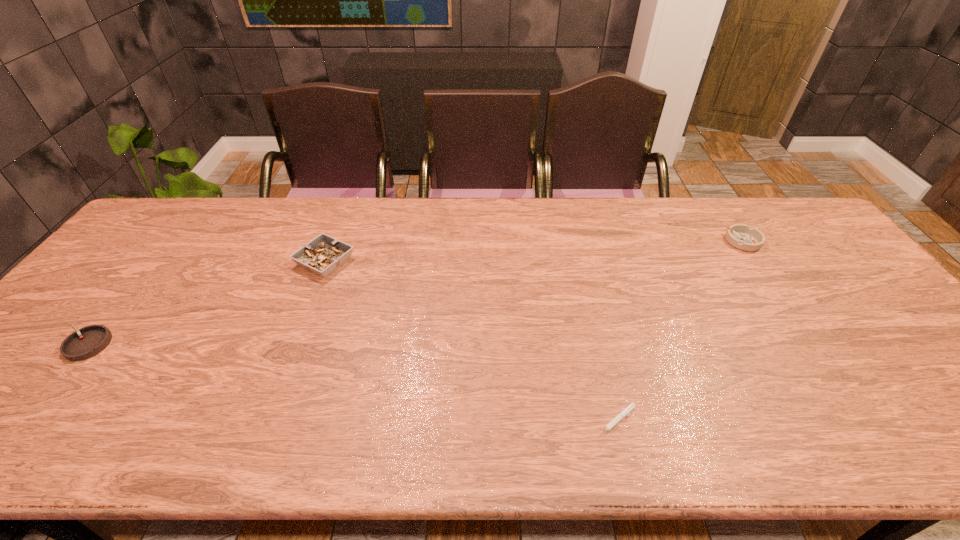
What are the coordinates of `free space between the third object from left to right and the rightmost object` in the screenshot? It's located at (680, 332).

You are a GUI agent. You are given a task and a screenshot of the screen. Output one action in this format:
    pyautogui.click(x=<x>, y=<y>)
    Task: Click on the empty location between the second object from right to left and the rightmost ashtray
    
    Given the screenshot: What is the action you would take?
    pyautogui.click(x=680, y=332)

Locate an element on the screen. Image resolution: width=960 pixels, height=540 pixels. free spot between the rightmost ashtray and the tallest ashtray is located at coordinates (534, 252).

At what (x,y) coordinates should I click in order to perform the action: click on blank region between the syringe and the rightmost object. Please return your answer as a coordinate pair (x, y). The image size is (960, 540). Looking at the image, I should click on (680, 332).

I want to click on empty space between the third object from left to right and the nearest ashtray, so click(x=351, y=383).

Identify the location of unoccupied area between the third object from left to right and the rightmost ashtray. (680, 332).

I want to click on empty space that is in between the third farthest object and the rightmost object, so click(x=416, y=293).

Locate an element on the screen. This screenshot has width=960, height=540. vacant space that is in between the syringe and the third farthest object is located at coordinates (351, 383).

This screenshot has width=960, height=540. Identify the location of free space between the second nearest object and the syringe. (351, 383).

You are a GUI agent. You are given a task and a screenshot of the screen. Output one action in this format:
    pyautogui.click(x=<x>, y=<y>)
    Task: Click on the empty space that is in between the nearest ashtray and the rightmost object
    Image resolution: width=960 pixels, height=540 pixels.
    Given the screenshot: What is the action you would take?
    pyautogui.click(x=416, y=293)